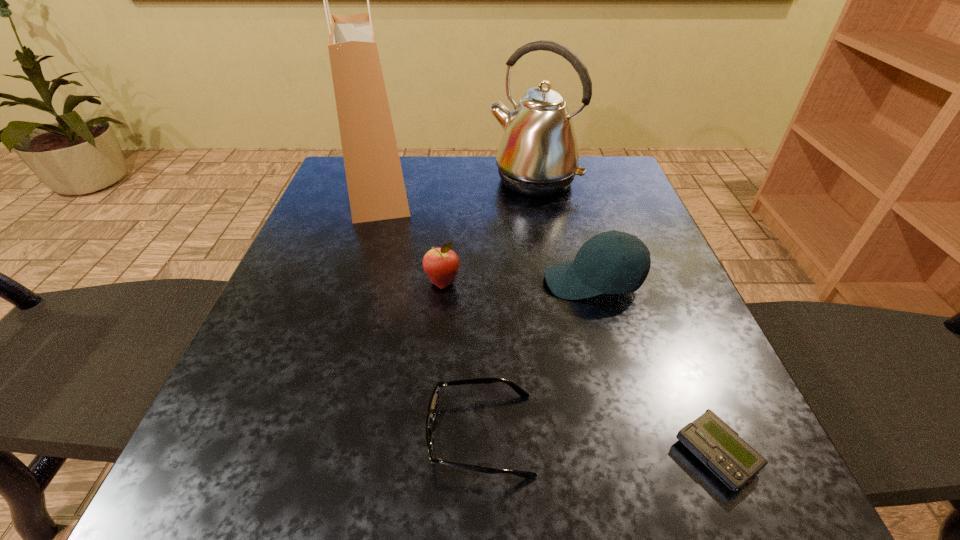
I want to click on vacant space situated on the front-facing side of the baseball cap, so pyautogui.click(x=496, y=281).

This screenshot has width=960, height=540. In order to click on free space located 0.050m on the front-facing side of the baseball cap in this screenshot , I will do `click(517, 281)`.

Where is `free space located on the right of the apple`? The height and width of the screenshot is (540, 960). free space located on the right of the apple is located at coordinates (639, 282).

I want to click on free space located on the front-facing side of the spectacles, so click(x=232, y=434).

Image resolution: width=960 pixels, height=540 pixels. I want to click on free spot located on the front-facing side of the spectacles, so click(x=363, y=434).

This screenshot has height=540, width=960. In order to click on free space located on the front-facing side of the spectacles in this screenshot , I will do `click(226, 434)`.

Image resolution: width=960 pixels, height=540 pixels. I want to click on vacant space located 0.050m on the back of the beeper, so click(688, 388).

Identify the location of shopping bag at the far edge. (376, 188).

Locate an element on the screen. kettle at the far edge is located at coordinates (538, 156).

Locate an element on the screen. This screenshot has height=540, width=960. spectacles that is at the near edge is located at coordinates (433, 404).